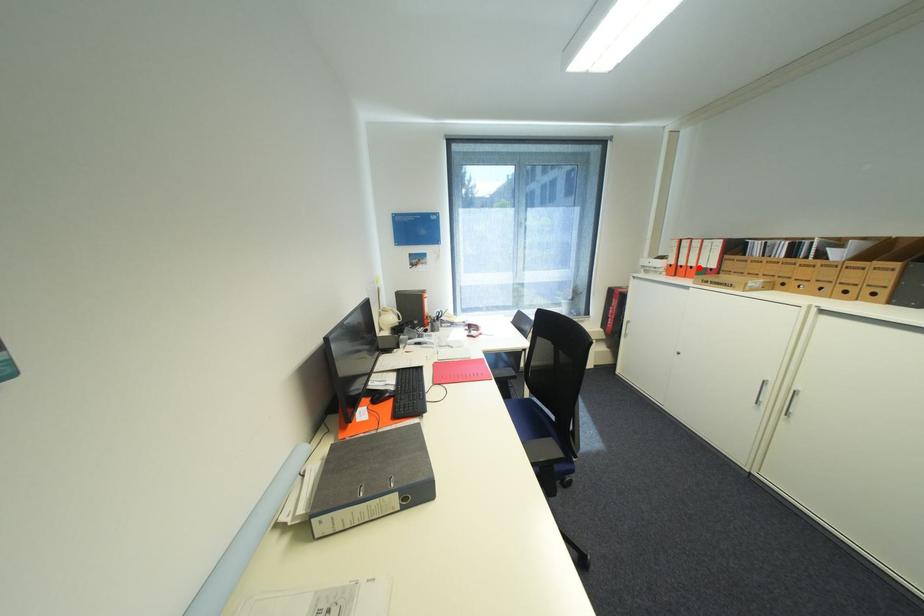
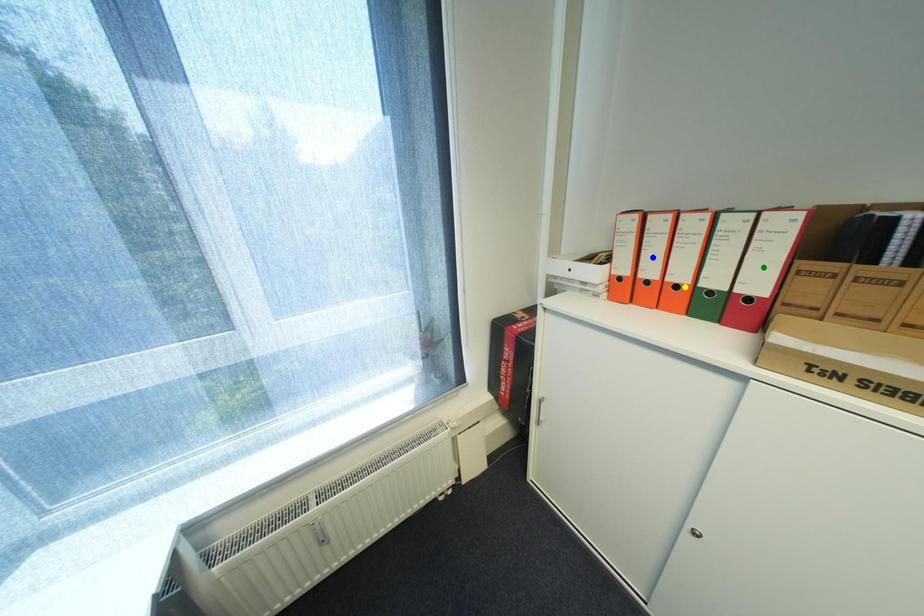
Question: I am providing you with two images of the same scene from different viewpoints. A red point is marked on the first image. You are given multiple points on the second image. Which point in image 2 represents the same 3d spot as the red point in image 1?

Choices:
 (A) green point
 (B) blue point
 (C) yellow point

Answer: (C)